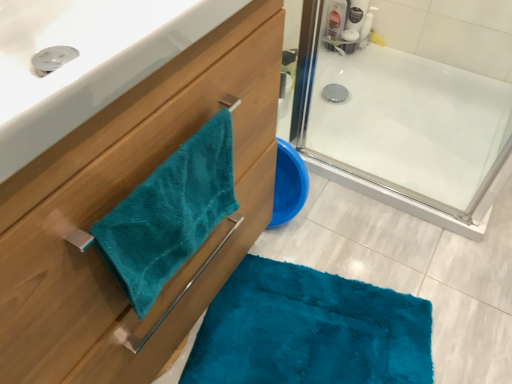
Locate an element on the screen. This screenshot has height=384, width=512. free spot to the right of teal plush towel at left is located at coordinates (318, 292).